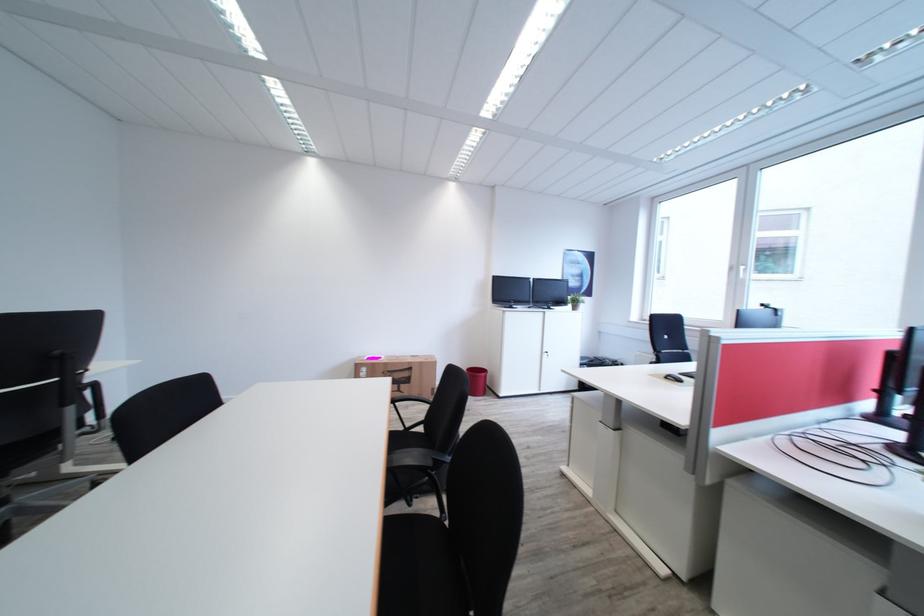
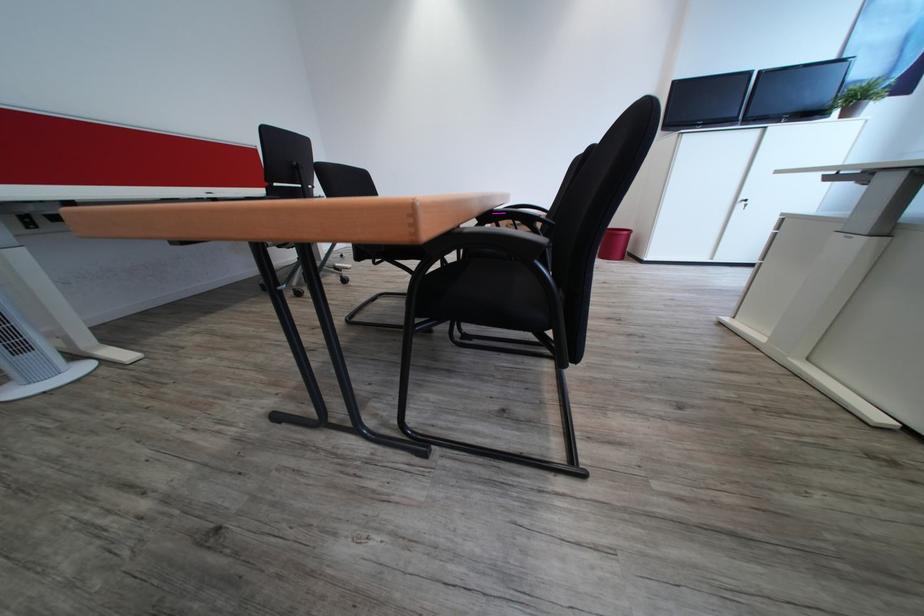
The images are taken continuously from a first-person perspective. In which direction is your viewpoint rotating?

The rotation direction of the camera is left-down.